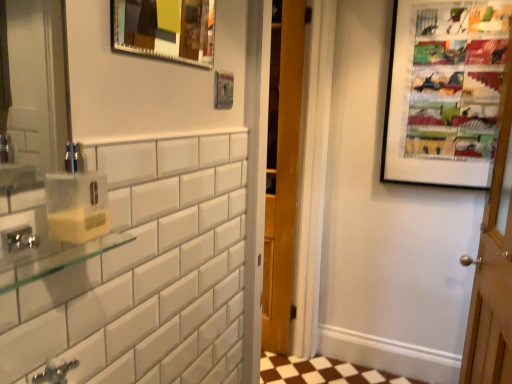
Question: Is clear glass shelf at left wider or thinner than yellow translucent soap dispenser at left?

Choices:
 (A) thin
 (B) wide

Answer: (A)

Question: Is clear glass shelf at left in front of or behind yellow translucent soap dispenser at left in the image?

Choices:
 (A) behind
 (B) front

Answer: (B)

Question: Which is nearer to the wooden door at right?

Choices:
 (A) clear glass shelf at left
 (B) yellow translucent soap dispenser at left
 (C) matte black picture frame at upper right, the third picture frame in the left-to-right sequence
 (D) metallic silver picture frame at upper center, the 2th picture frame positioned from the back
 (E) metallic silver picture frame at upper center, acting as the first picture frame starting from the left

Answer: (C)

Question: Estimate the real-world distances between objects in this image. Which object is closer to the yellow translucent soap dispenser at left?

Choices:
 (A) matte black picture frame at upper right, which is the third picture frame in front-to-back order
 (B) metallic silver picture frame at upper center, the 3th picture frame in the right-to-left sequence
 (C) metallic silver picture frame at upper center, the 2th picture frame positioned from the back
 (D) clear glass shelf at left
 (E) wooden door at right

Answer: (D)